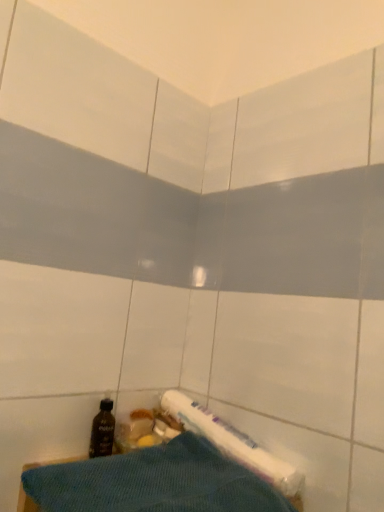
Question: Does blue textured towel at lower center have a larger size compared to black plastic bottle at lower left?

Choices:
 (A) no
 (B) yes

Answer: (B)

Question: Does blue textured towel at lower center have a smaller size compared to black plastic bottle at lower left?

Choices:
 (A) no
 (B) yes

Answer: (A)

Question: Is blue textured towel at lower center placed right next to black plastic bottle at lower left?

Choices:
 (A) no
 (B) yes

Answer: (A)

Question: Does blue textured towel at lower center have a greater height compared to black plastic bottle at lower left?

Choices:
 (A) yes
 (B) no

Answer: (A)

Question: From the image's perspective, is blue textured towel at lower center below black plastic bottle at lower left?

Choices:
 (A) no
 (B) yes

Answer: (B)

Question: Is blue textured towel at lower center positioned in front of black plastic bottle at lower left?

Choices:
 (A) no
 (B) yes

Answer: (B)

Question: Is black plastic bottle at lower left further to the viewer compared to blue textured towel at lower center?

Choices:
 (A) yes
 (B) no

Answer: (A)

Question: From the image's perspective, is black plastic bottle at lower left located beneath blue textured towel at lower center?

Choices:
 (A) yes
 (B) no

Answer: (B)

Question: From a real-world perspective, is black plastic bottle at lower left positioned under blue textured towel at lower center based on gravity?

Choices:
 (A) yes
 (B) no

Answer: (B)

Question: Is black plastic bottle at lower left at the left side of blue textured towel at lower center?

Choices:
 (A) no
 (B) yes

Answer: (B)

Question: Is black plastic bottle at lower left surrounding blue textured towel at lower center?

Choices:
 (A) yes
 (B) no

Answer: (B)

Question: Can you confirm if black plastic bottle at lower left is wider than blue textured towel at lower center?

Choices:
 (A) yes
 (B) no

Answer: (B)

Question: Would you say black plastic bottle at lower left is to the left or to the right of blue textured towel at lower center in the picture?

Choices:
 (A) right
 (B) left

Answer: (B)